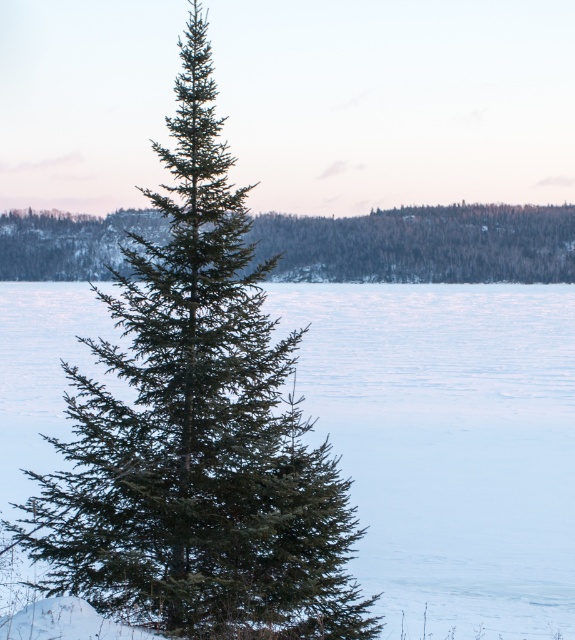
You are standing at the camera position and want to walk directly to the green matte fir tree at center. How far will you have to walk in meters?

The green matte fir tree at center is 12.53 meters away from the camera, so you will have to walk 12.53 meters to reach it.

You are an explorer in winter gear standing at the edge of the frozen lake. You see the green matte evergreen tree at center and the white ice at center. Which object is directly beneath the tree?

The white ice at center is positioned under the green matte evergreen tree at center, so the white ice at center is directly beneath the tree.